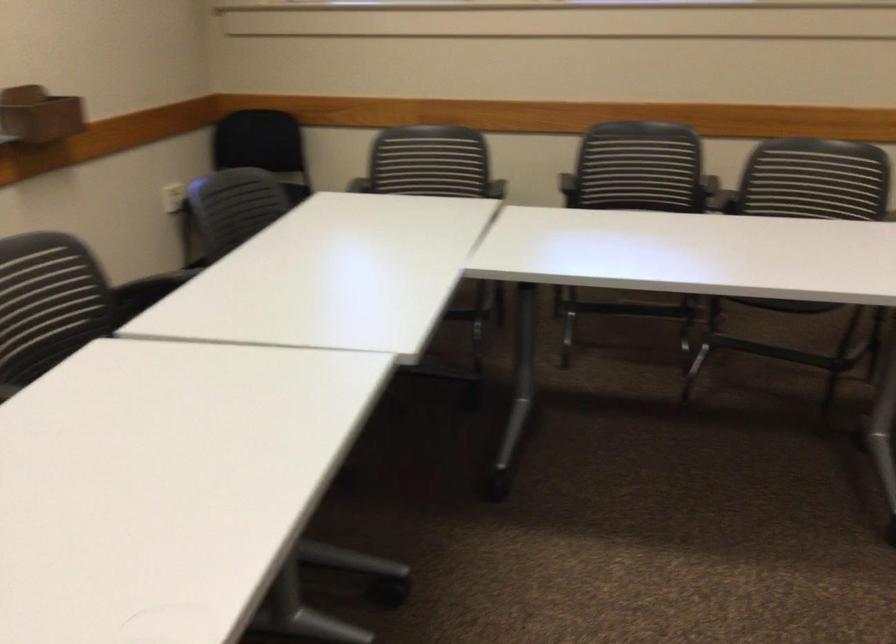
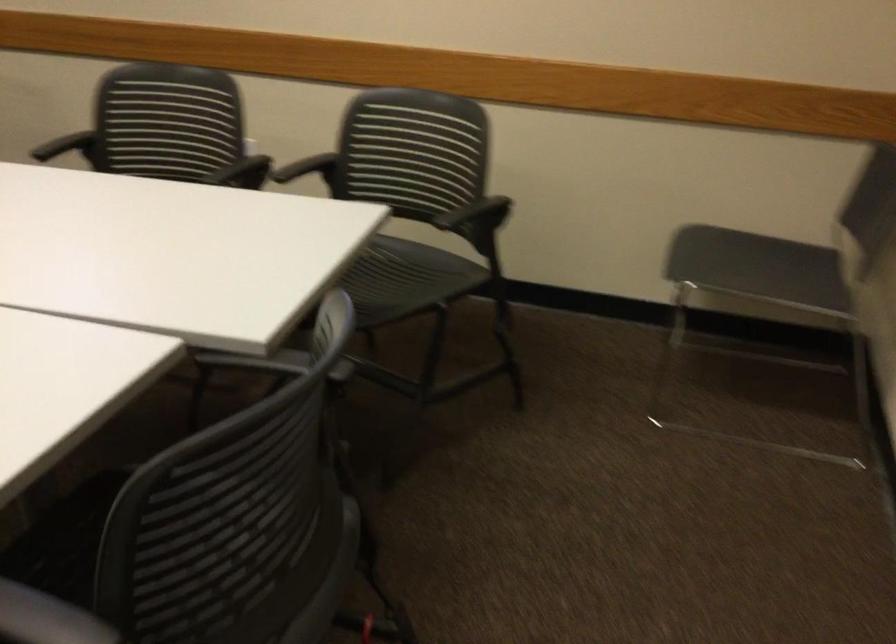
Question: In a continuous first-person perspective shot, in which direction is the camera moving?

Choices:
 (A) Left
 (B) Right
 (C) Forward
 (D) Backward

Answer: (B)